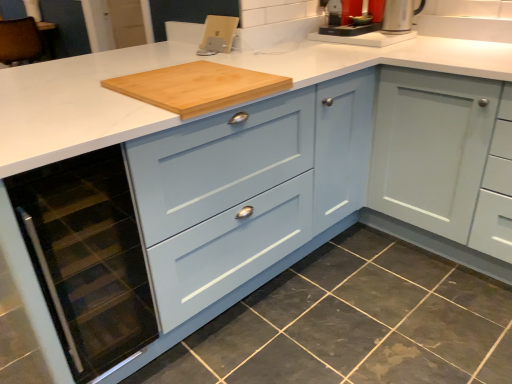
Question: Would you say silver metallic coffee machine at upper center contains matte glass oven at lower left?

Choices:
 (A) yes
 (B) no

Answer: (B)

Question: Does silver metallic coffee machine at upper center have a larger size compared to matte glass oven at lower left?

Choices:
 (A) yes
 (B) no

Answer: (B)

Question: Is silver metallic coffee machine at upper center outside of matte glass oven at lower left?

Choices:
 (A) yes
 (B) no

Answer: (A)

Question: From the image's perspective, is silver metallic coffee machine at upper center under matte glass oven at lower left?

Choices:
 (A) no
 (B) yes

Answer: (A)

Question: Does silver metallic coffee machine at upper center appear on the left side of matte glass oven at lower left?

Choices:
 (A) no
 (B) yes

Answer: (A)

Question: From a real-world perspective, is silver metallic coffee machine at upper center positioned under matte glass oven at lower left based on gravity?

Choices:
 (A) no
 (B) yes

Answer: (A)

Question: Is matte glass oven at lower left positioned far away from silver metallic kettle at upper right?

Choices:
 (A) no
 (B) yes

Answer: (B)

Question: Can you confirm if matte glass oven at lower left is taller than silver metallic kettle at upper right?

Choices:
 (A) no
 (B) yes

Answer: (B)

Question: Is the position of matte glass oven at lower left more distant than that of silver metallic kettle at upper right?

Choices:
 (A) yes
 (B) no

Answer: (B)

Question: Considering the relative sizes of matte glass oven at lower left and silver metallic kettle at upper right in the image provided, is matte glass oven at lower left thinner than silver metallic kettle at upper right?

Choices:
 (A) no
 (B) yes

Answer: (A)

Question: Is matte glass oven at lower left closer to the viewer compared to silver metallic kettle at upper right?

Choices:
 (A) yes
 (B) no

Answer: (A)

Question: Is matte glass oven at lower left facing towards silver metallic kettle at upper right?

Choices:
 (A) no
 (B) yes

Answer: (A)

Question: From the image's perspective, would you say dark gray granite at lower left is shown under silver metallic coffee machine at upper center?

Choices:
 (A) no
 (B) yes

Answer: (B)